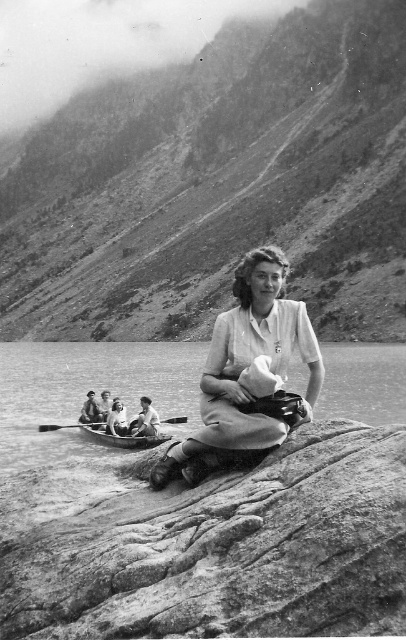
Question: From the image, what is the correct spatial relationship of wooden canoe at center in relation to wooden paddle at center?

Choices:
 (A) left
 (B) right

Answer: (B)

Question: Does smooth fabric shirt at center come behind smooth leather jacket at lower left?

Choices:
 (A) no
 (B) yes

Answer: (A)

Question: Which object is closer to the camera taking this photo?

Choices:
 (A) rough textured rock at lower center
 (B) matte white dress at center

Answer: (A)

Question: Estimate the real-world distances between objects in this image. Which object is farther from the smooth fabric shirt at center?

Choices:
 (A) smooth leather jacket at lower left
 (B) matte white dress at center

Answer: (B)

Question: Is wooden canoe at center further to the viewer compared to smooth fabric shirt at center?

Choices:
 (A) yes
 (B) no

Answer: (B)

Question: Which object is closer to the camera taking this photo?

Choices:
 (A) smooth leather jacket at lower left
 (B) smooth fabric shirt at center
 (C) smooth skin person at center

Answer: (B)